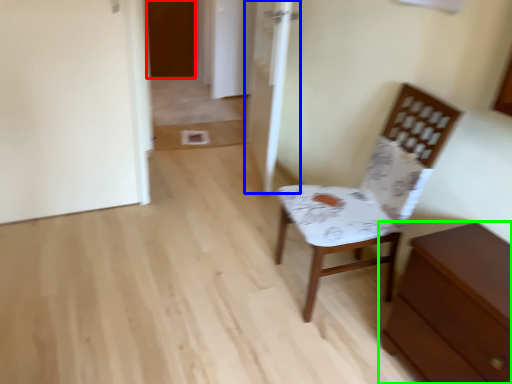
Question: Which object is the closest to the door (highlighted by a red box)? Choose among these: door (highlighted by a blue box) or chest of drawers (highlighted by a green box).

Choices:
 (A) door
 (B) chest of drawers

Answer: (A)